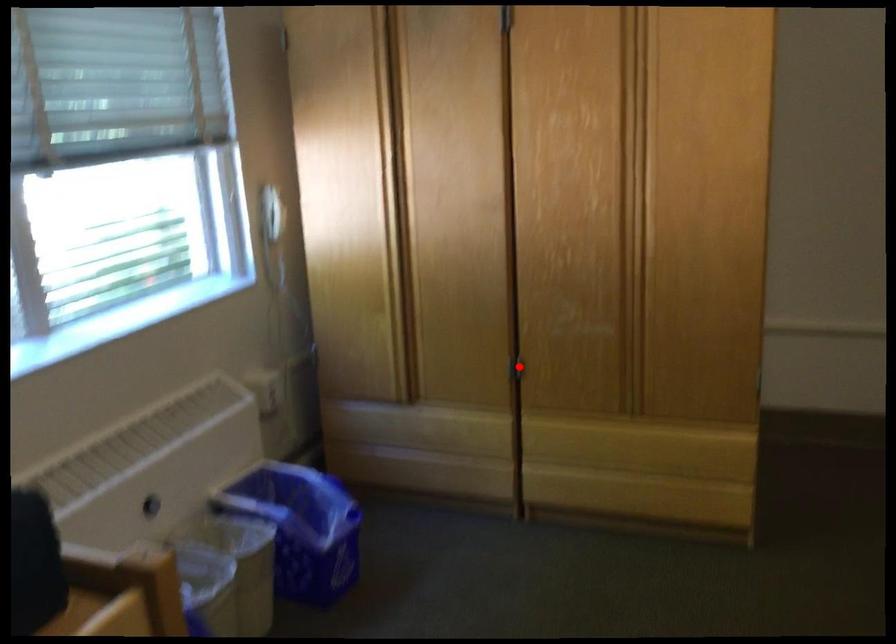
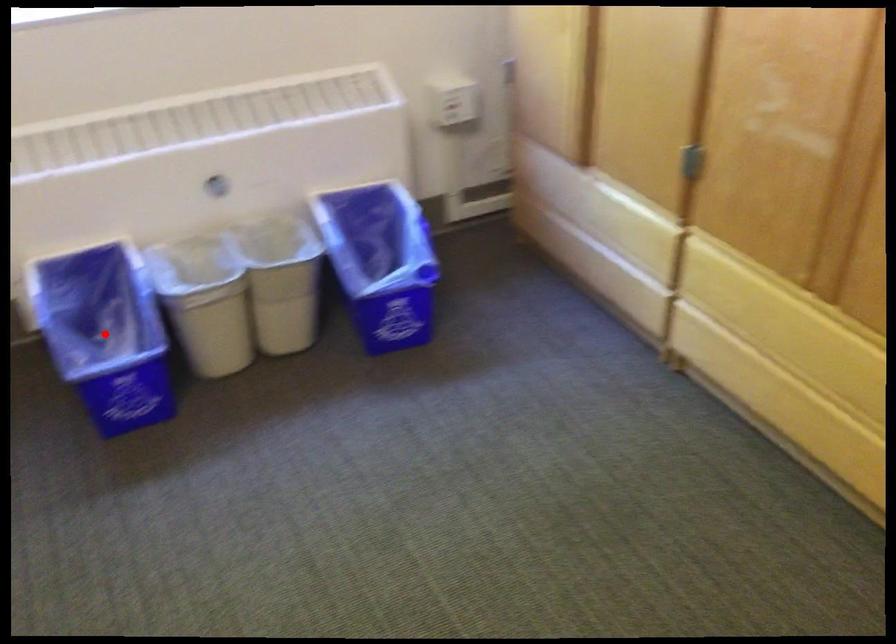
I am providing you with two images of the same scene from different viewpoints. A red point is marked on the first image and another point is marked on the second image. Do the highlighted points in image1 and image2 indicate the same real-world spot?

No